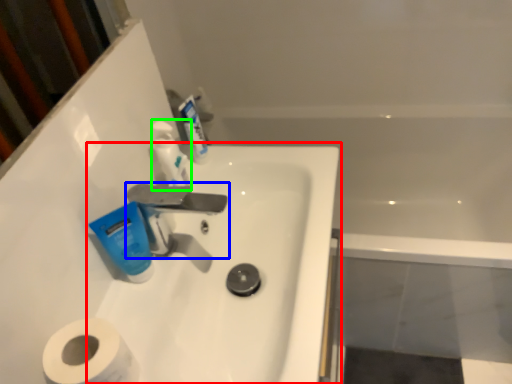
Question: Which object is positioned farthest from sink (highlighted by a red box)? Select from tap (highlighted by a blue box) and toiletry (highlighted by a green box).

Choices:
 (A) tap
 (B) toiletry

Answer: (B)